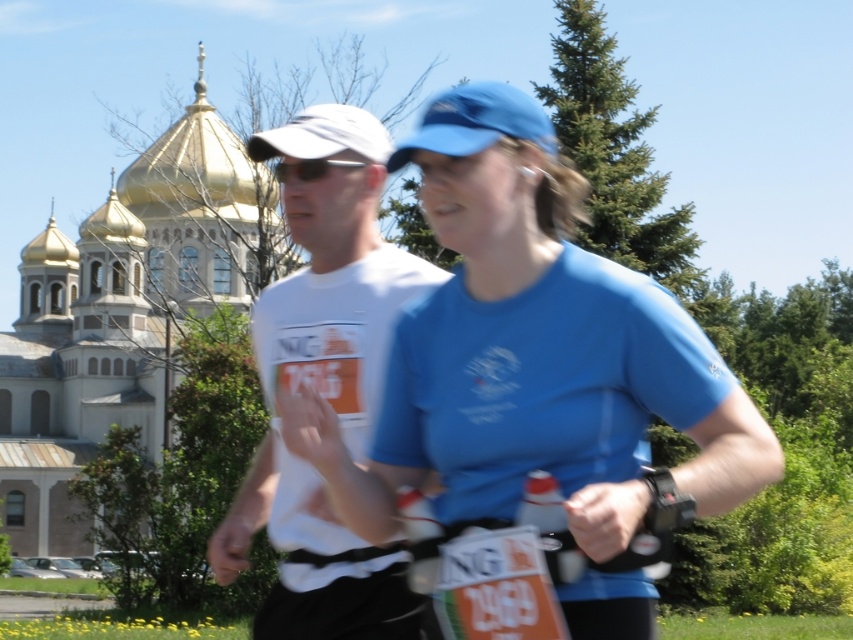
Question: Which of the following is the farthest from the observer?

Choices:
 (A) (316, 177)
 (B) (465, 225)

Answer: (A)

Question: Does white matte t-shirt at center have a lesser width compared to black plastic sunglasses at center?

Choices:
 (A) yes
 (B) no

Answer: (B)

Question: Which of the following is the farthest from the observer?

Choices:
 (A) black plastic sunglasses at center
 (B) white matte t-shirt at center
 (C) blue fabric shirt at center

Answer: (A)

Question: Is blue fabric shirt at center positioned at the back of white matte t-shirt at center?

Choices:
 (A) no
 (B) yes

Answer: (A)

Question: Is blue fabric shirt at center smaller than white matte t-shirt at center?

Choices:
 (A) yes
 (B) no

Answer: (B)

Question: Which object is the closest to the white matte t-shirt at center?

Choices:
 (A) black plastic sunglasses at center
 (B) blue fabric shirt at center

Answer: (B)